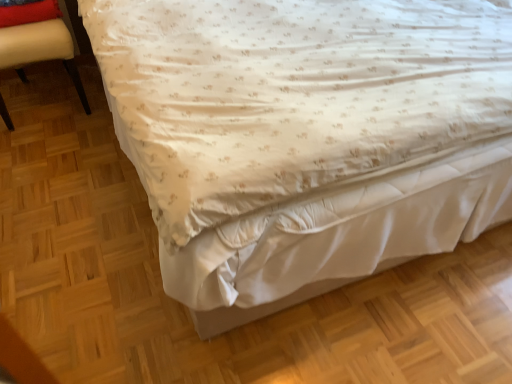
Question: Is beige leather chair at left closer to the viewer compared to red velvet pillow at upper left?

Choices:
 (A) no
 (B) yes

Answer: (B)

Question: Is beige leather chair at left looking in the opposite direction of red velvet pillow at upper left?

Choices:
 (A) no
 (B) yes

Answer: (A)

Question: From the image's perspective, is beige leather chair at left above red velvet pillow at upper left?

Choices:
 (A) no
 (B) yes

Answer: (A)

Question: Is beige leather chair at left next to red velvet pillow at upper left and touching it?

Choices:
 (A) no
 (B) yes

Answer: (B)

Question: Is beige leather chair at left to the left of red velvet pillow at upper left from the viewer's perspective?

Choices:
 (A) no
 (B) yes

Answer: (B)

Question: From the image's perspective, would you say beige leather chair at left is shown under red velvet pillow at upper left?

Choices:
 (A) yes
 (B) no

Answer: (A)

Question: From a real-world perspective, is red velvet pillow at upper left over beige leather chair at left?

Choices:
 (A) no
 (B) yes

Answer: (B)

Question: Considering the relative sizes of red velvet pillow at upper left and beige leather chair at left in the image provided, is red velvet pillow at upper left taller than beige leather chair at left?

Choices:
 (A) no
 (B) yes

Answer: (A)

Question: Can you confirm if red velvet pillow at upper left is shorter than beige leather chair at left?

Choices:
 (A) no
 (B) yes

Answer: (B)

Question: Does red velvet pillow at upper left have a lesser width compared to beige leather chair at left?

Choices:
 (A) no
 (B) yes

Answer: (B)

Question: From a real-world perspective, is red velvet pillow at upper left under beige leather chair at left?

Choices:
 (A) yes
 (B) no

Answer: (B)

Question: Is beige leather chair at left a part of red velvet pillow at upper left?

Choices:
 (A) no
 (B) yes

Answer: (A)

Question: Is beige leather chair at left in front of or behind red velvet pillow at upper left in the image?

Choices:
 (A) behind
 (B) front

Answer: (B)